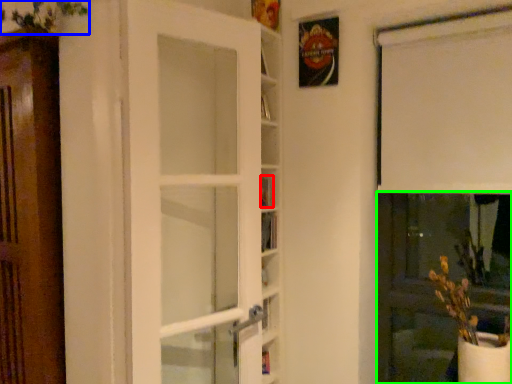
Question: Considering the real-world distances, which object is closest to book (highlighted by a red box)? plant (highlighted by a blue box) or screen door (highlighted by a green box).

Choices:
 (A) plant
 (B) screen door

Answer: (A)